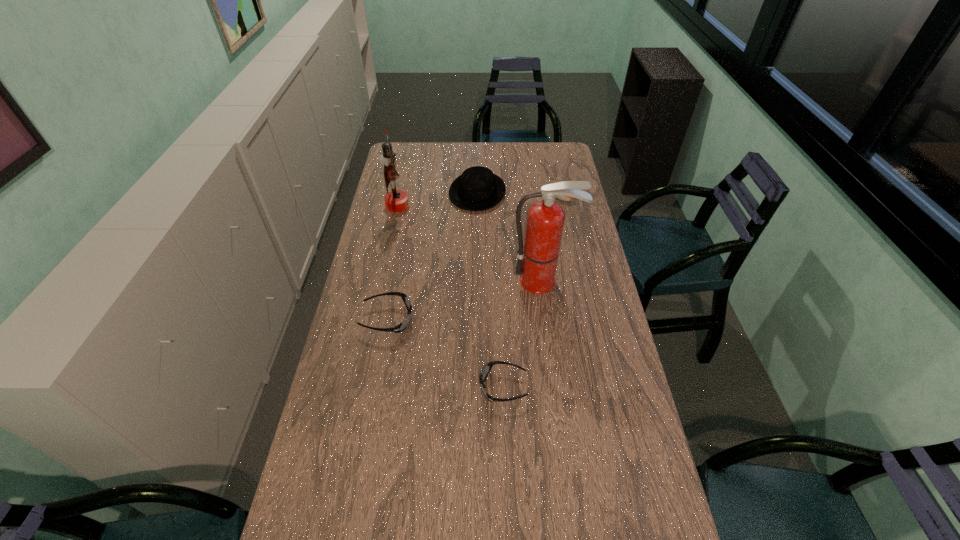
This screenshot has height=540, width=960. In order to click on vacant region located on the lenses of the shorter sunglasses in this screenshot , I will do `click(348, 387)`.

Image resolution: width=960 pixels, height=540 pixels. What are the coordinates of `free region located 0.320m on the lenses of the shorter sunglasses` in the screenshot? It's located at (372, 387).

You are a GUI agent. You are given a task and a screenshot of the screen. Output one action in this format:
    pyautogui.click(x=<x>, y=<y>)
    Task: Click on the free spot located on the front-facing side of the nutcracker
    Image resolution: width=960 pixels, height=540 pixels.
    Given the screenshot: What is the action you would take?
    pyautogui.click(x=460, y=205)

Where is `free space located 0.090m on the front of the sushi`? The height and width of the screenshot is (540, 960). free space located 0.090m on the front of the sushi is located at coordinates [x=566, y=216].

Where is `free point located on the front of the fedora`? This screenshot has height=540, width=960. free point located on the front of the fedora is located at coordinates (477, 236).

Locate an element on the screen. The width and height of the screenshot is (960, 540). vacant space located 0.350m with the handle and hose on the fire extinguisher is located at coordinates (556, 381).

Where is `sunglasses situated at the left edge`? This screenshot has height=540, width=960. sunglasses situated at the left edge is located at coordinates (403, 325).

Image resolution: width=960 pixels, height=540 pixels. Identify the location of nutcracker that is at the left edge. (396, 201).

The image size is (960, 540). What are the coordinates of `sushi that is at the right edge` in the screenshot? It's located at (561, 197).

Identify the location of fire extinguisher that is at the right edge. (537, 261).